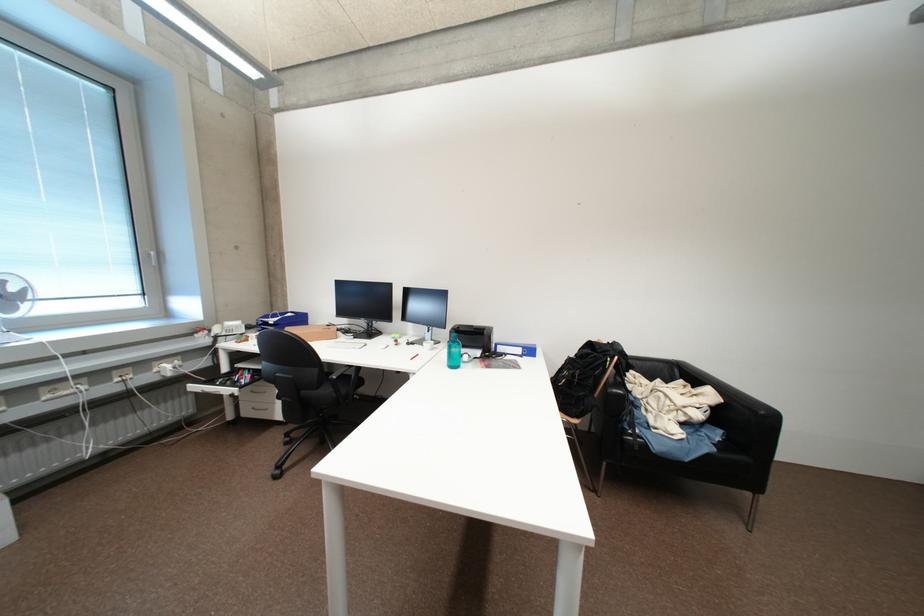
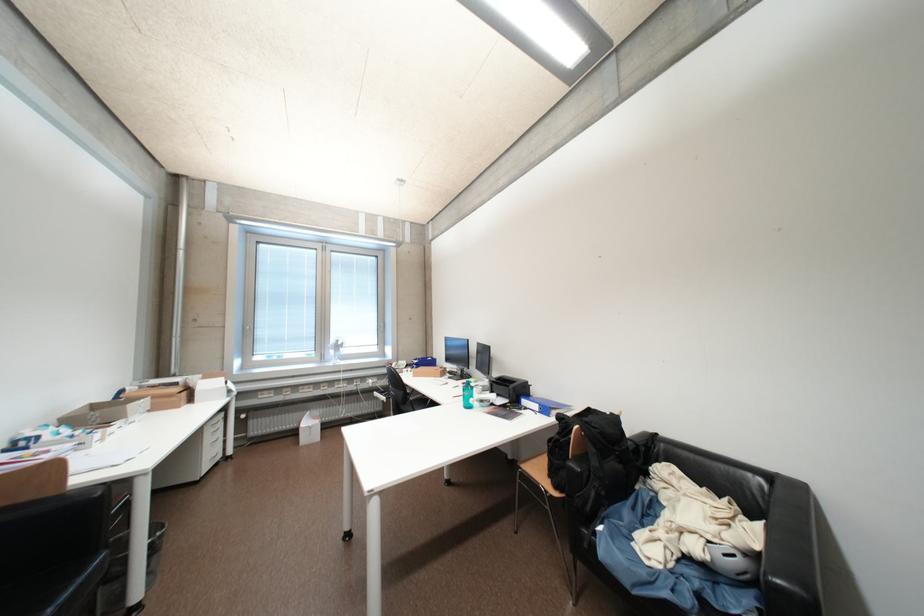
The point at (720, 410) is marked in the first image. Where is the corresponding point in the second image?

(751, 556)